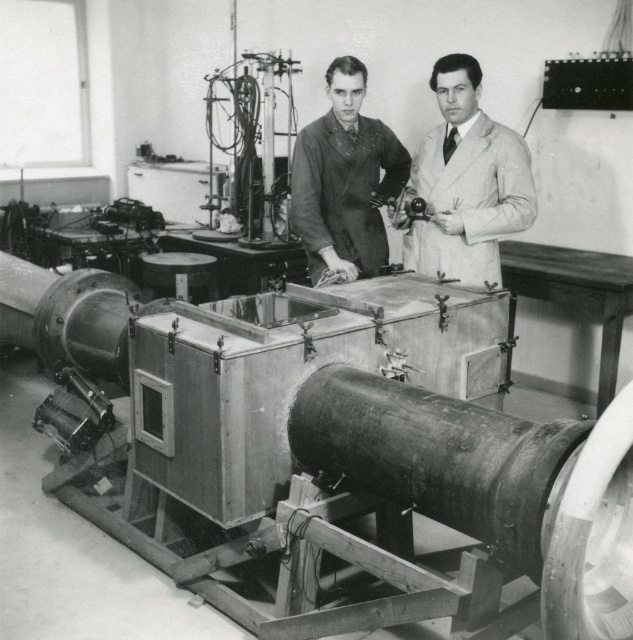
Looking at this image, you are a guest entering the laboratory and see both the white wool coat at center and the smooth black suit at center. Which one is positioned more to the right side of the scene?

The white wool coat at center is positioned more to the right side of the scene than the smooth black suit at center.

You are standing in a historical laboratory and need to locate the white wool coat at center. According to the coordinates provided, where exactly should you look to find it?

The white wool coat at center is located at the coordinates point [465,182].